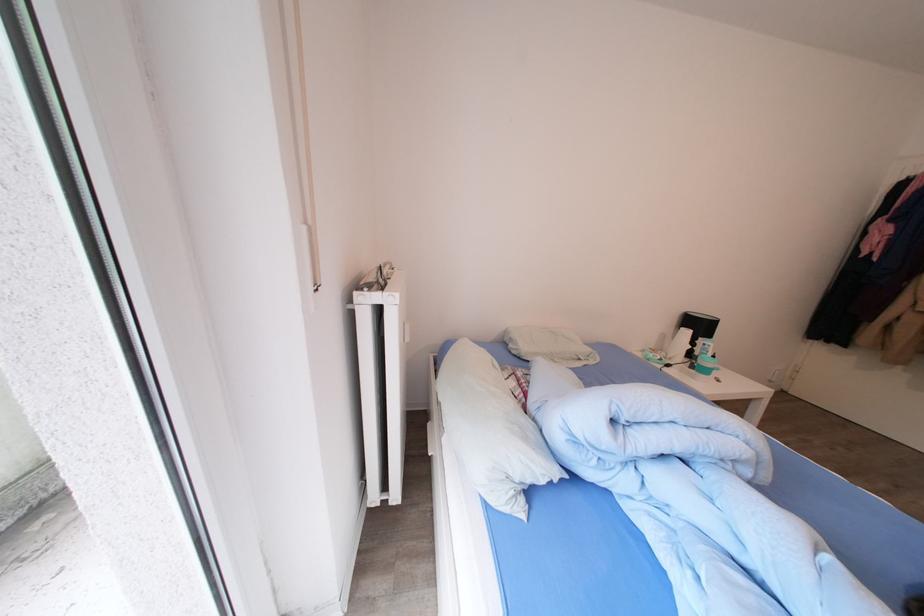
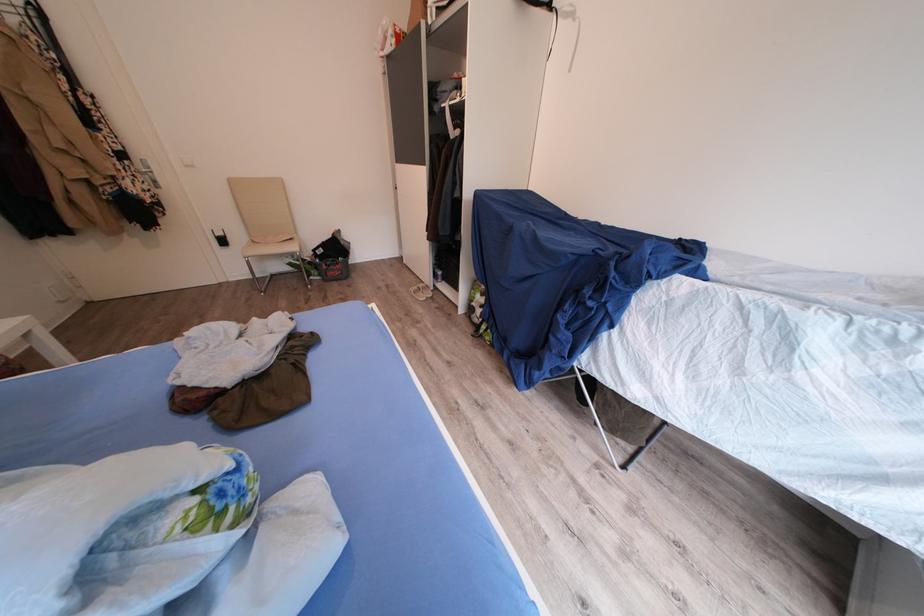
Based on the continuous images, in which direction is the camera rotating?

The rotation direction of the camera is right-down.